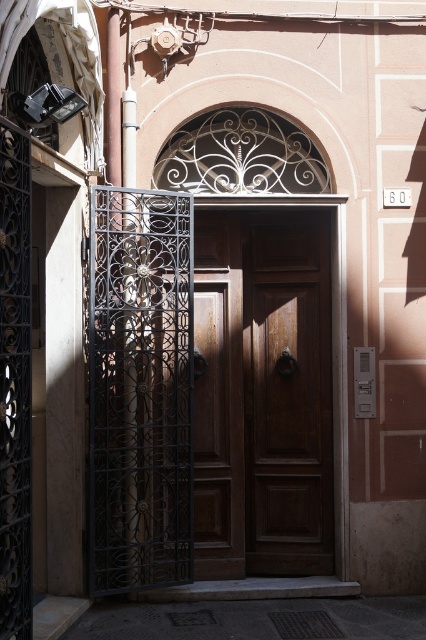
Who is taller, polished wood door at center or black wrought iron gate at left?

Standing taller between the two is black wrought iron gate at left.

Can you confirm if polished wood door at center is positioned below black wrought iron gate at left?

Correct, polished wood door at center is located below black wrought iron gate at left.

Is point (232, 211) farther from viewer compared to point (127, 531)?

Yes, it is behind point (127, 531).

At what (x,y) coordinates should I click in order to perform the action: click on polished wood door at center. Please return your answer as a coordinate pair (x, y). Looking at the image, I should click on (262, 394).